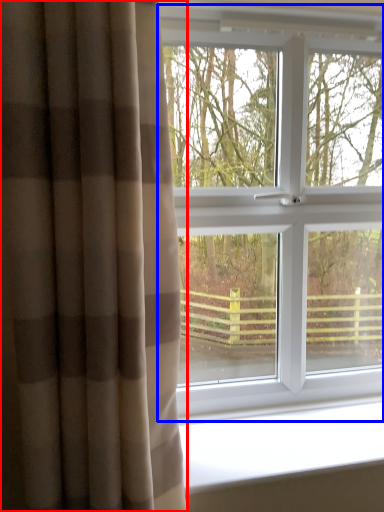
Question: Which point is closer to the camera, curtain (highlighted by a red box) or window (highlighted by a blue box)?

Choices:
 (A) curtain
 (B) window

Answer: (A)